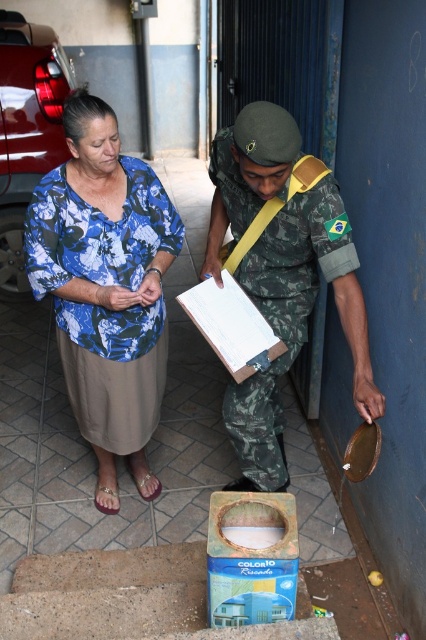
You are standing at point (250,180) and want to walk to point (216,292). Which direction should you move in?

You should move backward because point (250,180) is in front of point (216,292).

You are a photographer trying to capture a clear photo of the white cardboard clipboard at center. Since the camouflage uniform at center is blocking your view, can you move around to the left side to get a better shot?

The camouflage uniform at center is closer to the viewer than the white cardboard clipboard at center, so moving to the left side might allow you to see around the camouflage uniform at center to get a clearer view of the white cardboard clipboard at center.

You are standing at the origin point of the coordinate system. Which direction should you move to reach the blue floral blouse at center?

The blue floral blouse at center is located at point 0.450 in the x direction and 0.249 in the y direction. So you should move right along the x axis to 0.450 and up along the y axis to 0.249 to reach it.